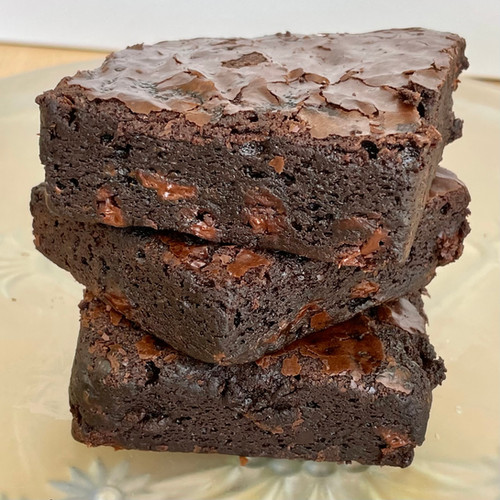
Identify the location of wall background. Image resolution: width=500 pixels, height=500 pixels. (486, 7), (483, 72), (426, 13), (309, 13), (202, 4), (88, 4), (8, 13), (145, 21), (107, 33).